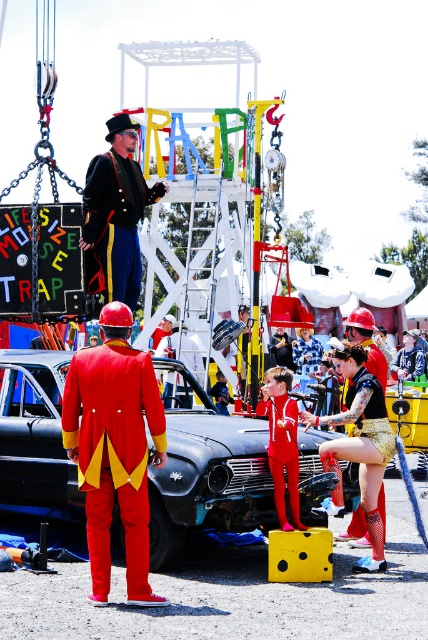
Which is below, shiny black uniform at center or red velvet suit at center?

red velvet suit at center is lower down.

Is shiny black uniform at center smaller than red velvet suit at center?

No.

Which is in front, point (106, 172) or point (291, 500)?

Point (291, 500) is in front.

The height and width of the screenshot is (640, 428). Identify the location of shiny black uniform at center. (115, 214).

Looking at this image, is the position of black glossy car at center more distant than that of red velvet suit at center?

No, it is not.

Is black glossy car at center closer to camera compared to red velvet suit at center?

Yes.

Is point (36, 413) behind point (290, 429)?

Yes, point (36, 413) is behind point (290, 429).

Where is `black glossy car at center`? The height and width of the screenshot is (640, 428). black glossy car at center is located at coordinates (205, 472).

Can you confirm if black glossy car at center is shorter than shiny black uniform at center?

Yes, black glossy car at center is shorter than shiny black uniform at center.

Does black glossy car at center have a larger size compared to shiny black uniform at center?

Actually, black glossy car at center might be smaller than shiny black uniform at center.

Is point (32, 474) positioned in front of point (115, 244)?

Yes, it is.

Find the location of a particular element. This screenshot has width=428, height=640. black glossy car at center is located at coordinates (205, 472).